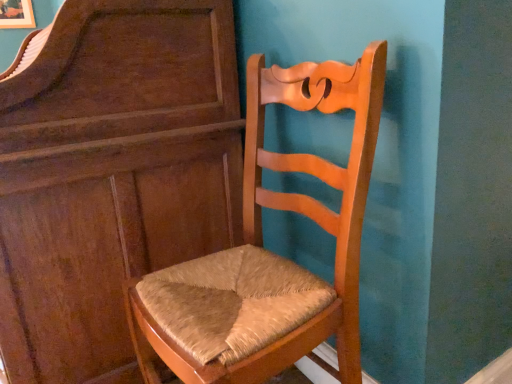
Question: Is light brown wood chair at center bigger or smaller than matte brown dresser at center?

Choices:
 (A) small
 (B) big

Answer: (A)

Question: Considering their positions, is light brown wood chair at center located in front of or behind matte brown dresser at center?

Choices:
 (A) behind
 (B) front

Answer: (B)

Question: In the image, is light brown wood chair at center on the left side or the right side of matte brown dresser at center?

Choices:
 (A) left
 (B) right

Answer: (B)

Question: Is matte brown dresser at center taller or shorter than light brown wood chair at center?

Choices:
 (A) short
 (B) tall

Answer: (B)

Question: Looking at their shapes, would you say matte brown dresser at center is wider or thinner than light brown wood chair at center?

Choices:
 (A) wide
 (B) thin

Answer: (A)

Question: Which is correct: matte brown dresser at center is inside light brown wood chair at center, or outside of it?

Choices:
 (A) outside
 (B) inside

Answer: (A)

Question: From a real-world perspective, is matte brown dresser at center physically located above or below light brown wood chair at center?

Choices:
 (A) below
 (B) above

Answer: (B)